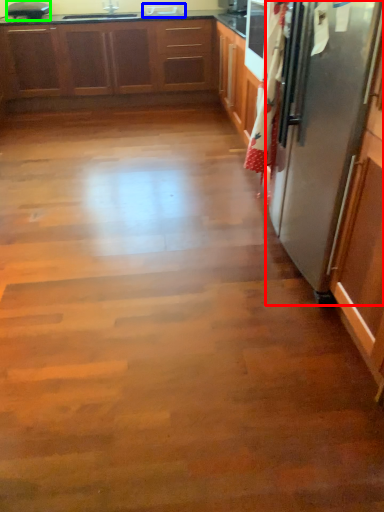
Question: Which object is positioned farthest from refrigerator (highlighted by a red box)? Select from sink (highlighted by a blue box) and appliance (highlighted by a green box).

Choices:
 (A) sink
 (B) appliance

Answer: (B)